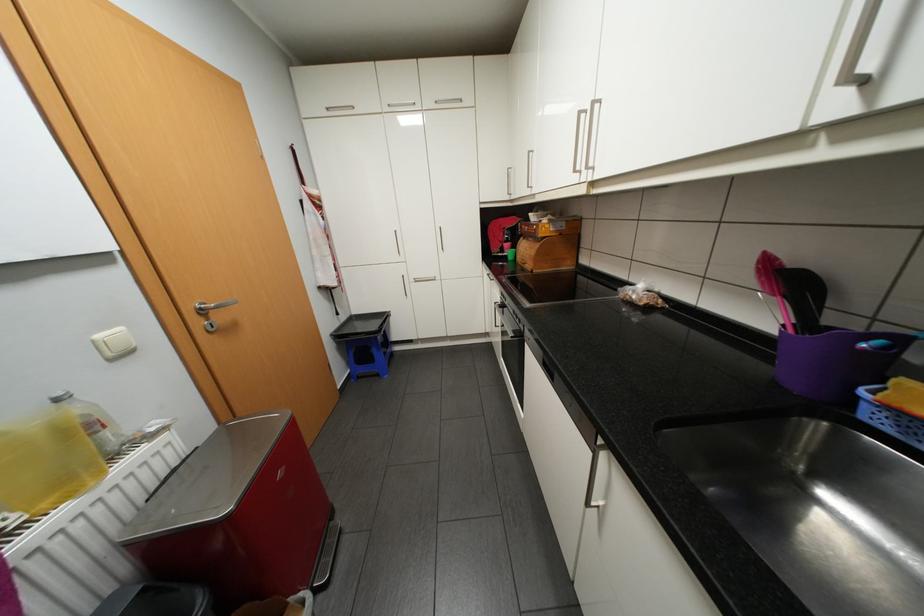
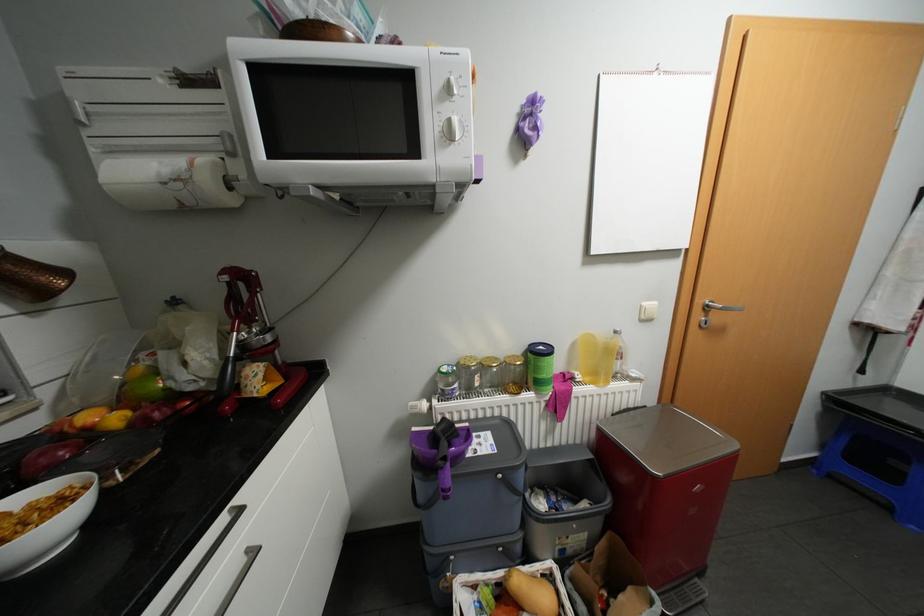
The point at (123, 456) is marked in the first image. Where is the corresponding point in the second image?

(622, 377)